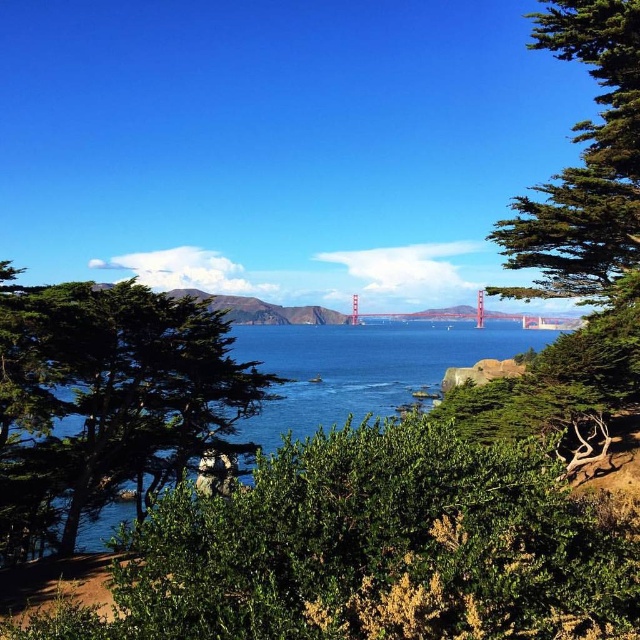
You are standing at the camera position and want to take a photo of the green leafy tree at center. If your camera has a maximum focus range of 20 meters, will it be able to focus on the tree?

The distance between the green leafy tree at center and the camera is 20.81 meters. Since the camera can only focus up to 20 meters, it will not be able to focus on the tree.